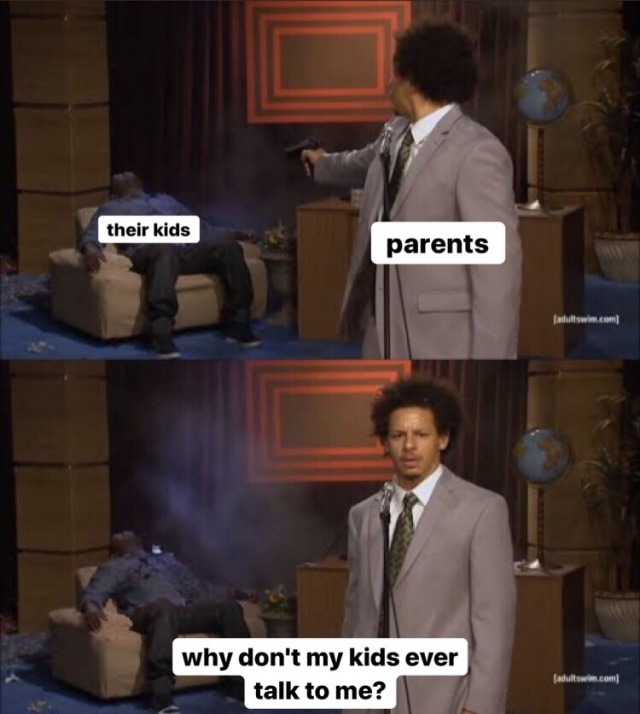
This screenshot has height=714, width=640. What are the coordinates of `globe` in the screenshot? It's located at (548, 457), (541, 94).